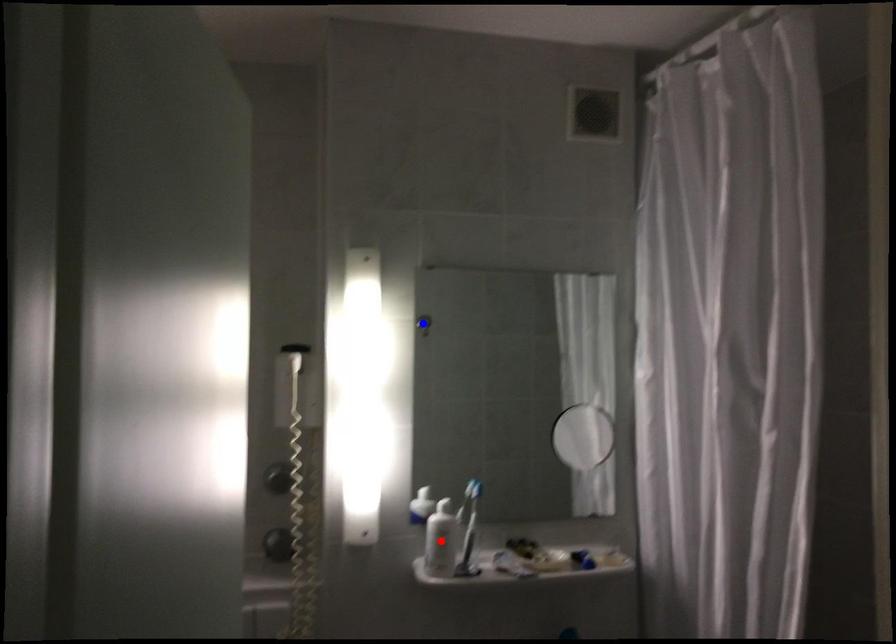
Question: Two points are marked on the image. Which point is closer to the camera?

Choices:
 (A) Blue point is closer.
 (B) Red point is closer.

Answer: (B)